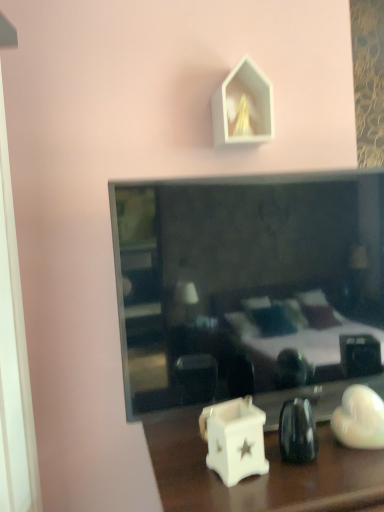
I want to click on free space in front of white ceramic candle holder at lower center, so click(x=240, y=497).